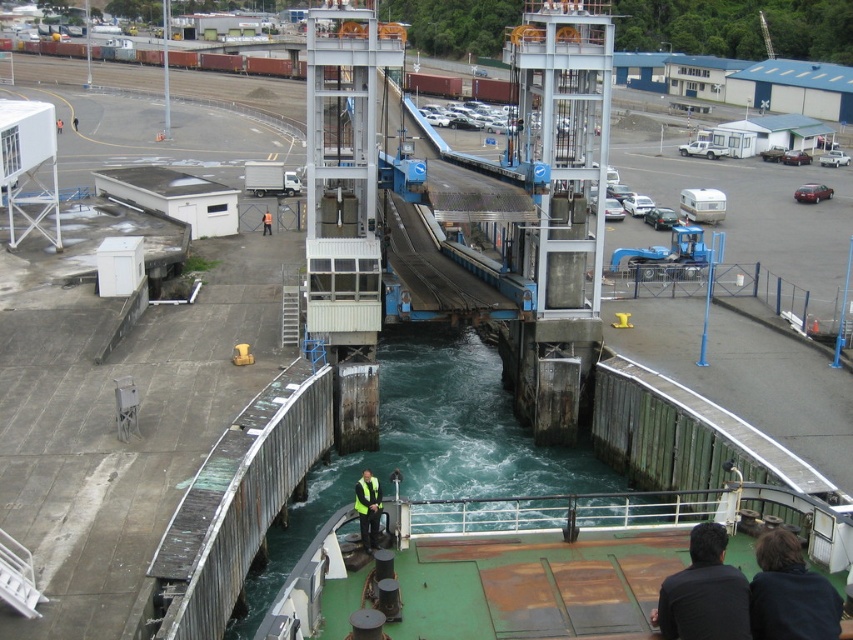
Question: Which point is closer to the camera taking this photo?

Choices:
 (A) tap(471, 451)
 (B) tap(717, 637)
 (C) tap(746, 557)
 (D) tap(759, 589)

Answer: (B)

Question: Estimate the real-world distances between objects in this image. Which object is farther from the orange reflective vest at center?

Choices:
 (A) dark brown leather jacket at lower right
 (B) black fabric at lower right
 (C) yellow reflective vest at lower center
 (D) greenish-blue water at center

Answer: (A)

Question: Can you confirm if rusty metal boat at center is wider than dark brown leather jacket at lower right?

Choices:
 (A) yes
 (B) no

Answer: (A)

Question: Based on their relative distances, which object is nearer to the orange reflective vest at center?

Choices:
 (A) black fabric at lower right
 (B) greenish-blue water at center

Answer: (B)

Question: Can you confirm if dark brown leather jacket at lower right is wider than yellow reflective vest at lower center?

Choices:
 (A) yes
 (B) no

Answer: (A)

Question: Is rusty metal boat at center positioned before black fabric at lower right?

Choices:
 (A) no
 (B) yes

Answer: (A)